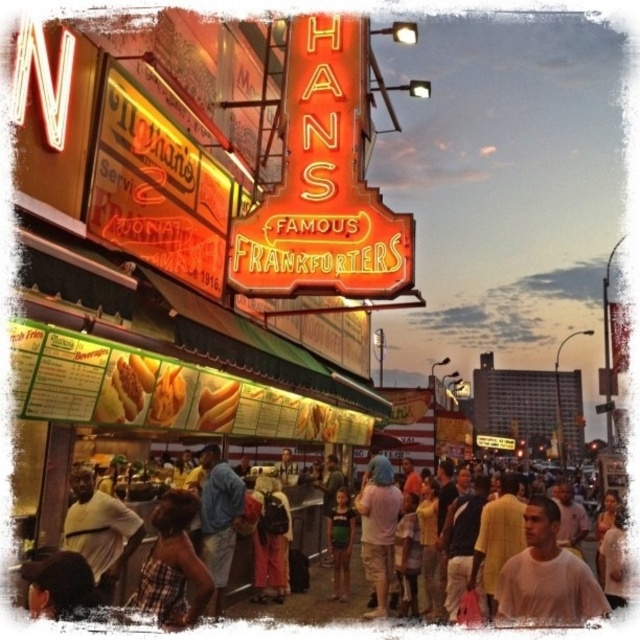
You are a customer waiting in line at the food stand. You notice two shirts hanging on a rack behind the counter. The shirts are labeled as light blue fabric shirt at center and light brown fabric shirt at lower center. Which shirt is positioned more to the left?

The light brown fabric shirt at lower center is positioned more to the left because the light blue fabric shirt at center is to the right of it.

You are a customer looking to order from the menu board at the food stand. You notice two items at the center of the scene. Which one is bigger, the light blue fabric shirt at center or the golden fried hot dog at center?

The light blue fabric shirt at center is larger in size than the golden fried hot dog at center.

You are a customer at the food stand and want to order the tallest corn dish available. Which one should you choose between the golden fried corn at center and the golden corn at center?

The golden fried corn at center is much taller than the golden corn at center, so you should choose the golden fried corn at center.